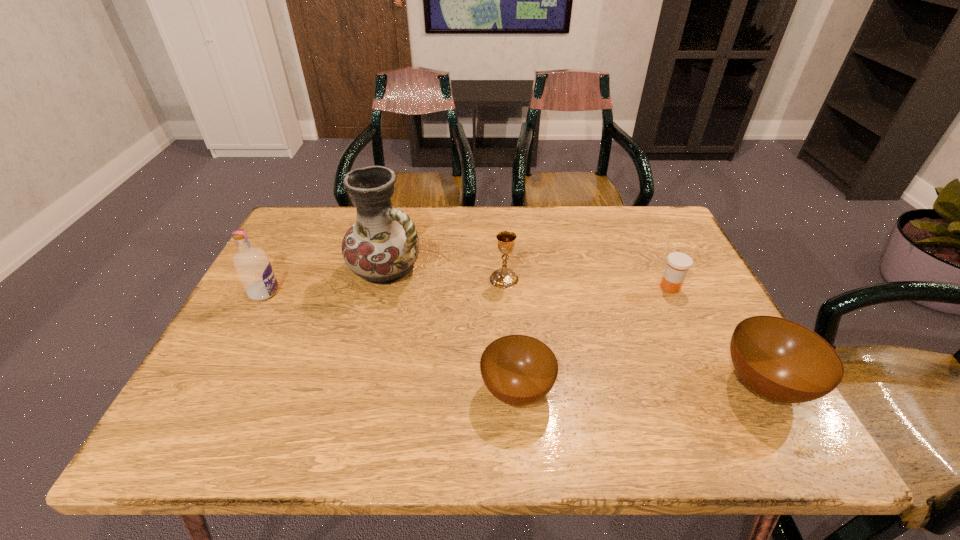
Where is `the left bowl`? This screenshot has width=960, height=540. the left bowl is located at coordinates (519, 370).

At what (x,y) coordinates should I click in order to perform the action: click on the right bowl. Please return your answer as a coordinate pair (x, y). Looking at the image, I should click on (781, 360).

Identify the location of the third tallest object. This screenshot has width=960, height=540. (504, 278).

The image size is (960, 540). I want to click on the leftmost object, so click(x=253, y=267).

The image size is (960, 540). Find the location of `the fifth shortest object`. the fifth shortest object is located at coordinates (253, 267).

What are the coordinates of `the second object from left to right` in the screenshot? It's located at (382, 246).

The height and width of the screenshot is (540, 960). What are the coordinates of `vase` in the screenshot? It's located at (382, 246).

Find the location of a particular element. medicine is located at coordinates pos(678,264).

The image size is (960, 540). I want to click on vacant point located 0.300m on the right of the left bowl, so click(700, 390).

Identify the location of free spot located on the left of the right bowl. The width and height of the screenshot is (960, 540). (584, 384).